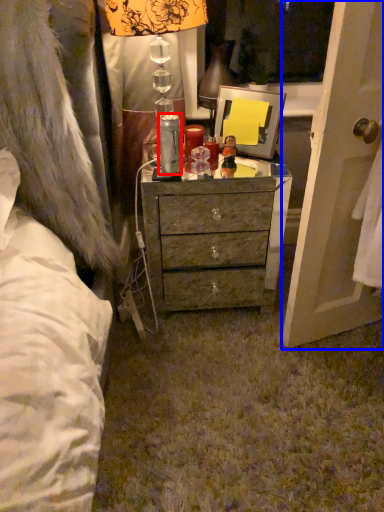
Question: Among these objects, which one is nearest to the camera, bottle (highlighted by a red box) or screen door (highlighted by a blue box)?

Choices:
 (A) bottle
 (B) screen door

Answer: (B)